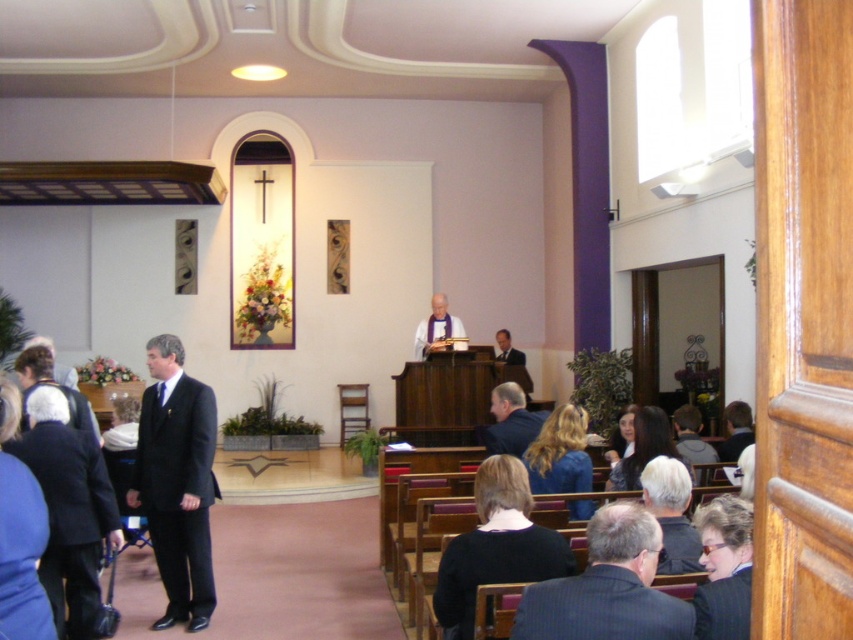
Who is positioned more to the left, gray hair at lower right or dark brown suit at lower right?

gray hair at lower right

Is point (670, 522) less distant than point (717, 449)?

Yes.

Is point (641, 477) farther from camera compared to point (737, 413)?

That is False.

The height and width of the screenshot is (640, 853). Identify the location of gray hair at lower right. (671, 513).

This screenshot has width=853, height=640. What do you see at coordinates (177, 481) in the screenshot? I see `matte black suit at left` at bounding box center [177, 481].

In the scene shown: Is matte black suit at left positioned at the back of matte white robe at center?

No, matte black suit at left is closer to the viewer.

Measure the distance between point (169,337) and camera.

Point (169,337) and camera are 17.20 feet apart.

This screenshot has height=640, width=853. In order to click on matte black suit at left in this screenshot , I will do `click(177, 481)`.

Does dark suit at lower left have a lesser height compared to dark suit at center?

No.

Between dark suit at lower left and dark suit at center, which one appears on the right side from the viewer's perspective?

dark suit at center

Which is in front, point (44, 371) or point (519, 355)?

Positioned in front is point (44, 371).

What are the coordinates of `dark suit at lower left` in the screenshot? It's located at (51, 385).